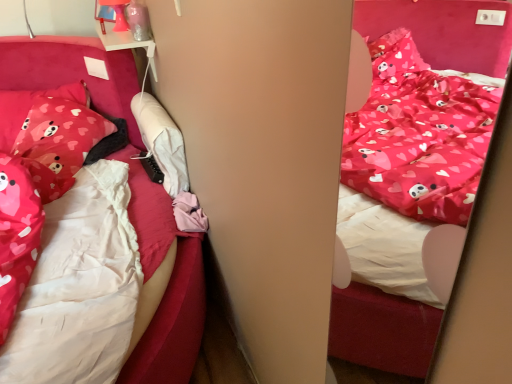
Identify the location of vacant space situated above matte pink pillow with heart patterns at left, which is the 2th pillow from left to right (from a real-world perspective). The width and height of the screenshot is (512, 384). (57, 106).